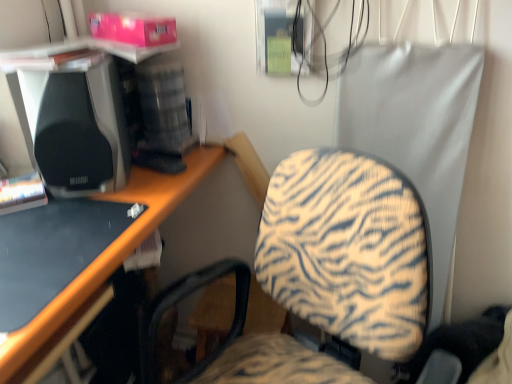
Question: From the image's perspective, is black glossy desk at lower left over black matte speaker at left?

Choices:
 (A) no
 (B) yes

Answer: (A)

Question: Can you confirm if black glossy desk at lower left is taller than black matte speaker at left?

Choices:
 (A) yes
 (B) no

Answer: (B)

Question: Is black glossy desk at lower left to the left of black matte speaker at left from the viewer's perspective?

Choices:
 (A) no
 (B) yes

Answer: (B)

Question: From a real-world perspective, is black glossy desk at lower left under black matte speaker at left?

Choices:
 (A) yes
 (B) no

Answer: (A)

Question: From a real-world perspective, does black glossy desk at lower left stand above black matte speaker at left?

Choices:
 (A) no
 (B) yes

Answer: (A)

Question: Considering the relative sizes of black glossy desk at lower left and black matte speaker at left in the image provided, is black glossy desk at lower left thinner than black matte speaker at left?

Choices:
 (A) no
 (B) yes

Answer: (A)

Question: Is black matte speaker at left bigger than black glossy desk at lower left?

Choices:
 (A) no
 (B) yes

Answer: (B)

Question: Are black matte speaker at left and black glossy desk at lower left making contact?

Choices:
 (A) yes
 (B) no

Answer: (B)

Question: Is black matte speaker at left not inside black glossy desk at lower left?

Choices:
 (A) yes
 (B) no

Answer: (A)

Question: Can black glossy desk at lower left be found inside black matte speaker at left?

Choices:
 (A) yes
 (B) no

Answer: (B)

Question: Is black matte speaker at left further to camera compared to black glossy desk at lower left?

Choices:
 (A) yes
 (B) no

Answer: (A)

Question: Is black matte speaker at left smaller than black glossy desk at lower left?

Choices:
 (A) yes
 (B) no

Answer: (B)

Question: Visually, is black matte speaker at left positioned to the left or to the right of black glossy desk at lower left?

Choices:
 (A) left
 (B) right

Answer: (B)